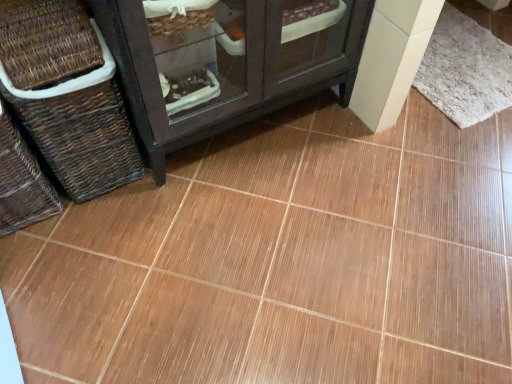
Find the location of a particular element. This screenshot has height=384, width=512. free space in front of white fluffy mat at upper right is located at coordinates (437, 155).